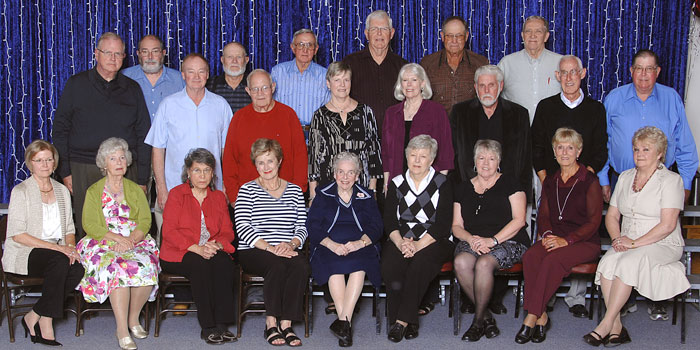
At what (x,y) coordinates should I click in order to perform the action: click on blue stage curtain. Please return your answer as a coordinate pair (x, y). Looking at the image, I should click on (64, 53).